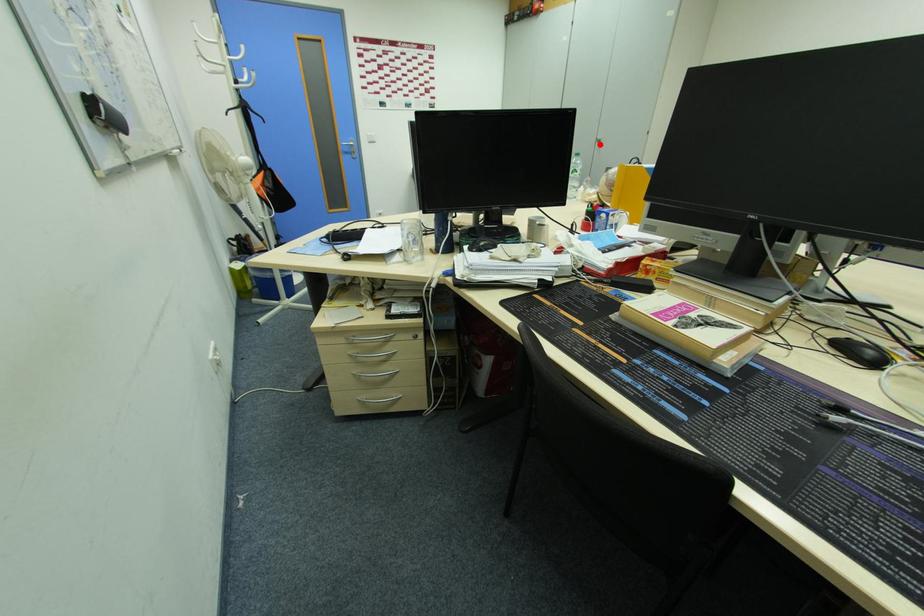
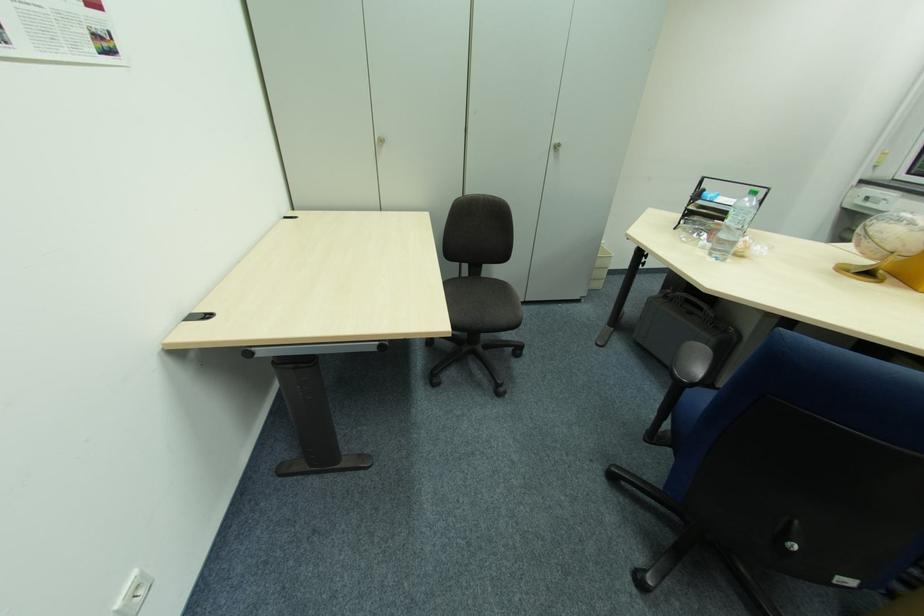
The point at the highlighted location is marked in the first image. Where is the corresponding point in the second image?

(554, 150)